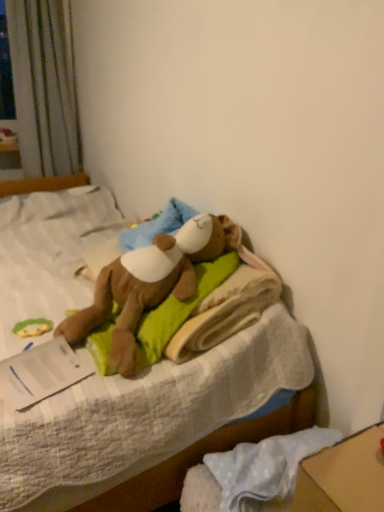
What is the approximate height of green fabric toy at lower left?

green fabric toy at lower left is 2.58 centimeters in height.

This screenshot has width=384, height=512. What are the coordinates of `green fabric toy at lower left` in the screenshot? It's located at (32, 327).

What do you see at coordinates (32, 327) in the screenshot? I see `green fabric toy at lower left` at bounding box center [32, 327].

In order to face green fabric toy at lower left, should I rotate leftwards or rightwards?

A 19.847 degree turn to the left will do.

What is the approximate height of soft plush bear at center?

28.63 inches.

Identify the location of soft plush bear at center. The image size is (384, 512). [154, 422].

Describe the element at coordinates (154, 422) in the screenshot. I see `soft plush bear at center` at that location.

At what (x,y) coordinates should I click in order to perform the action: click on green fabric toy at lower left. Please return your answer as a coordinate pair (x, y). Looking at the image, I should click on (32, 327).

Is green fabric toy at lower left at the left side of soft plush bear at center?

No.

Considering their positions, is green fabric toy at lower left located in front of or behind soft plush bear at center?

green fabric toy at lower left is positioned farther from the viewer than soft plush bear at center.

Which is in front, point (40, 335) or point (156, 369)?

The point (156, 369) is closer to the camera.

From the image's perspective, is green fabric toy at lower left on top of soft plush bear at center?

No, from the image's perspective, green fabric toy at lower left is not on top of soft plush bear at center.

From a real-world perspective, is green fabric toy at lower left above or below soft plush bear at center?

From a real-world perspective, green fabric toy at lower left is physically above soft plush bear at center.

Is green fabric toy at lower left wider or thinner than soft plush bear at center?

green fabric toy at lower left is thinner than soft plush bear at center.

Who is taller, green fabric toy at lower left or soft plush bear at center?

soft plush bear at center.

Is green fabric toy at lower left bigger or smaller than soft plush bear at center?

In the image, green fabric toy at lower left appears to be smaller than soft plush bear at center.

Is green fabric toy at lower left completely or partially outside of soft plush bear at center?

No, green fabric toy at lower left is not outside of soft plush bear at center.

Is the surface of green fabric toy at lower left in direct contact with soft plush bear at center?

No, green fabric toy at lower left is not making contact with soft plush bear at center.

Could you tell me if green fabric toy at lower left is facing soft plush bear at center?

Yes.

How different are the orientations of green fabric toy at lower left and soft plush bear at center in degrees?

90.4 degrees.

Where is `bed in front of the green fabric toy at lower left`? bed in front of the green fabric toy at lower left is located at coordinates (154, 422).

Is soft plush bear at center at the right side of green fabric toy at lower left?

No.

Is soft plush bear at center behind green fabric toy at lower left?

No.

Considering the points (124, 503) and (27, 331), which point is behind, point (124, 503) or point (27, 331)?

The point (27, 331) is farther from the camera.

From the image's perspective, is soft plush bear at center below green fabric toy at lower left?

No, from the image's perspective, soft plush bear at center is not below green fabric toy at lower left.

From a real-world perspective, which is physically below, soft plush bear at center or green fabric toy at lower left?

soft plush bear at center is physically lower.

Considering the relative sizes of soft plush bear at center and green fabric toy at lower left in the image provided, is soft plush bear at center wider than green fabric toy at lower left?

Indeed, soft plush bear at center has a greater width compared to green fabric toy at lower left.

Considering the relative sizes of soft plush bear at center and green fabric toy at lower left in the image provided, is soft plush bear at center taller than green fabric toy at lower left?

Indeed, soft plush bear at center has a greater height compared to green fabric toy at lower left.

Consider the image. Considering the sizes of objects soft plush bear at center and green fabric toy at lower left in the image provided, who is bigger, soft plush bear at center or green fabric toy at lower left?

With larger size is soft plush bear at center.

Is green fabric toy at lower left completely or partially inside soft plush bear at center?

Absolutely, green fabric toy at lower left is inside soft plush bear at center.

Would you say soft plush bear at center is a long distance from green fabric toy at lower left?

That's not correct — soft plush bear at center is a little close to green fabric toy at lower left.

Is soft plush bear at center oriented away from green fabric toy at lower left?

No, soft plush bear at center is not facing away from green fabric toy at lower left.

Can you tell me how much soft plush bear at center and green fabric toy at lower left differ in facing direction?

90.4 degrees separate the facing orientations of soft plush bear at center and green fabric toy at lower left.

How much distance is there between soft plush bear at center and green fabric toy at lower left?

17.23 inches.

In the image, there is a green fabric toy at lower left. At what (x,y) coordinates should I click in order to perform the action: click on bed above it (from the image's perspective). Please return your answer as a coordinate pair (x, y). Looking at the image, I should click on (154, 422).

Find the location of a particular element. This screenshot has height=512, width=384. bed on the left of green fabric toy at lower left is located at coordinates (154, 422).

Image resolution: width=384 pixels, height=512 pixels. What are the coordinates of `toy behind the soft plush bear at center` in the screenshot? It's located at (32, 327).